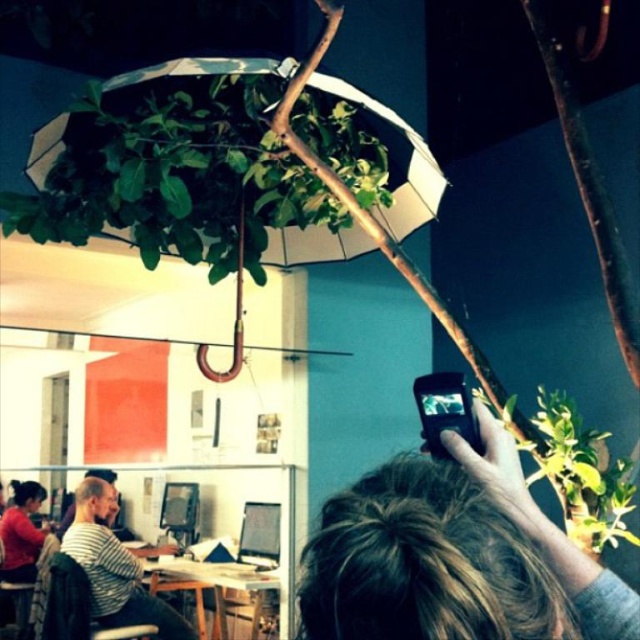
Is point (324, 230) positioned after point (273, 582)?

That is False.

Can you confirm if white matte umbrella at upper center is positioned below wooden table at center?

Actually, white matte umbrella at upper center is above wooden table at center.

What do you see at coordinates (406, 168) in the screenshot?
I see `white matte umbrella at upper center` at bounding box center [406, 168].

You are a GUI agent. You are given a task and a screenshot of the screen. Output one action in this format:
    pyautogui.click(x=<x>, y=<y>)
    Task: Click on the white matte umbrella at upper center
    The width and height of the screenshot is (640, 640).
    Given the screenshot: What is the action you would take?
    pyautogui.click(x=406, y=168)

Does white matte umbrella at upper center have a smaller size compared to striped cotton shirt at center?

No.

Does white matte umbrella at upper center have a larger size compared to striped cotton shirt at center?

Indeed, white matte umbrella at upper center has a larger size compared to striped cotton shirt at center.

Between point (176, 67) and point (124, 596), which one is positioned behind?

Positioned behind is point (124, 596).

Identify the location of white matte umbrella at upper center. (406, 168).

Between striped cotton shirt at center and wooden table at center, which one has more height?

Standing taller between the two is striped cotton shirt at center.

This screenshot has width=640, height=640. What do you see at coordinates (115, 566) in the screenshot?
I see `striped cotton shirt at center` at bounding box center [115, 566].

Which is in front, point (100, 556) or point (198, 612)?

Point (100, 556) is more forward.

Locate an element on the screen. The height and width of the screenshot is (640, 640). striped cotton shirt at center is located at coordinates (115, 566).